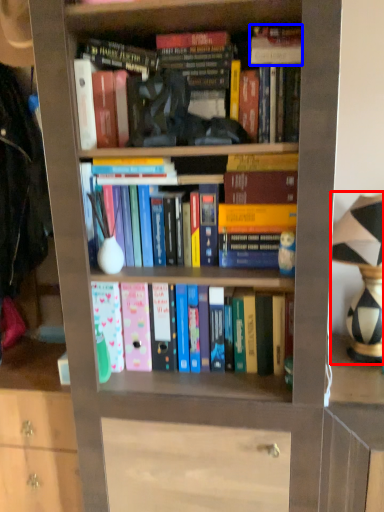
Question: Which object appears farthest to the camera in this image, table lamp (highlighted by a red box) or book (highlighted by a blue box)?

Choices:
 (A) table lamp
 (B) book

Answer: (B)